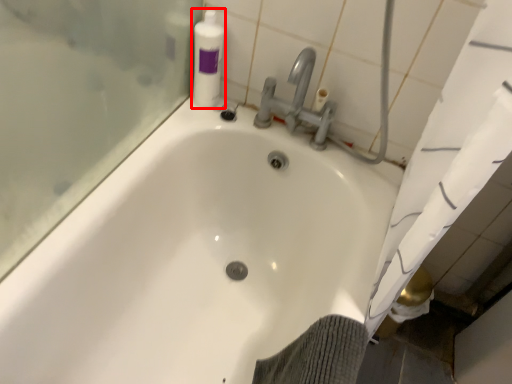
Question: Considering the relative positions of cleaning product (annotated by the red box) and bathtub in the image provided, where is cleaning product (annotated by the red box) located with respect to the staircase?

Choices:
 (A) left
 (B) right

Answer: (A)